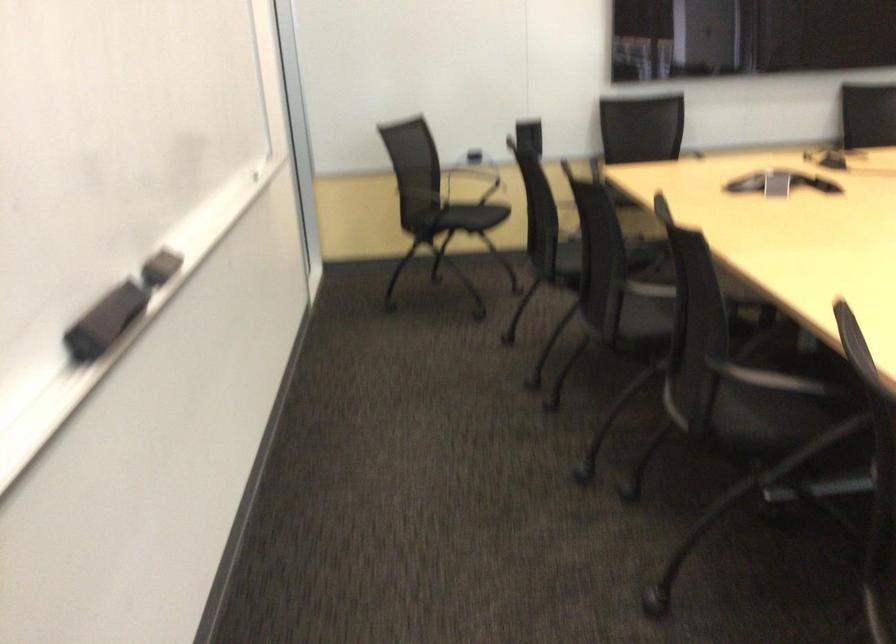
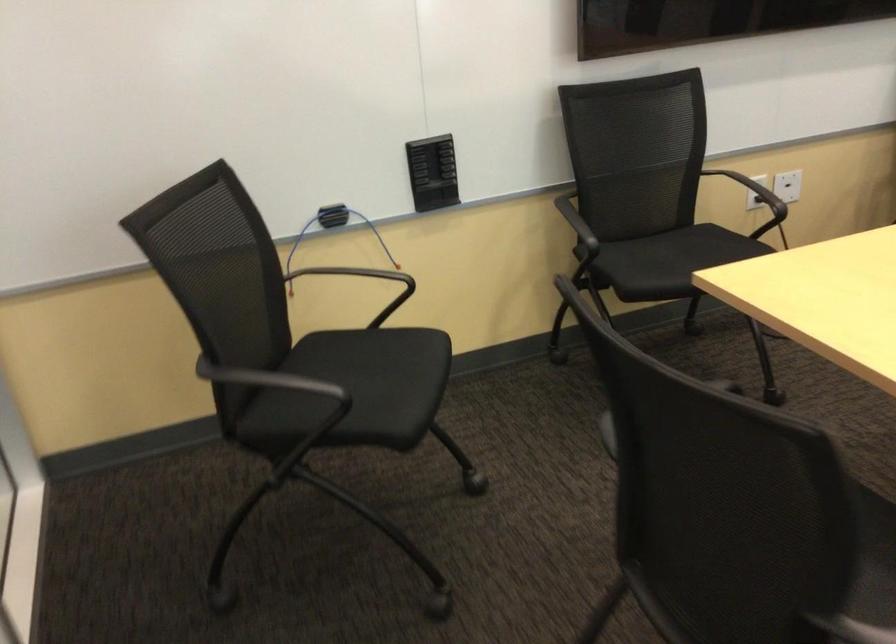
Question: What movement of the cameraman would produce the second image?

Choices:
 (A) Left
 (B) Right
 (C) Forward
 (D) Backward

Answer: (C)